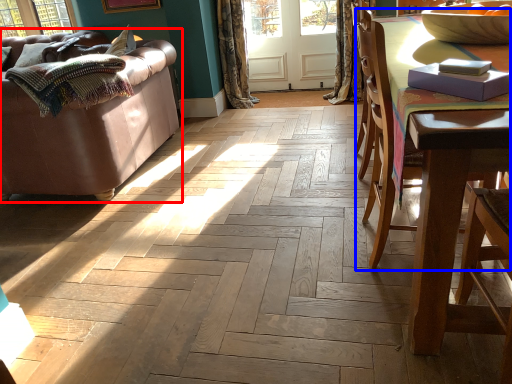
Question: Among these objects, which one is nearest to the camera, studio couch (highlighted by a red box) or chair (highlighted by a blue box)?

Choices:
 (A) studio couch
 (B) chair

Answer: (B)